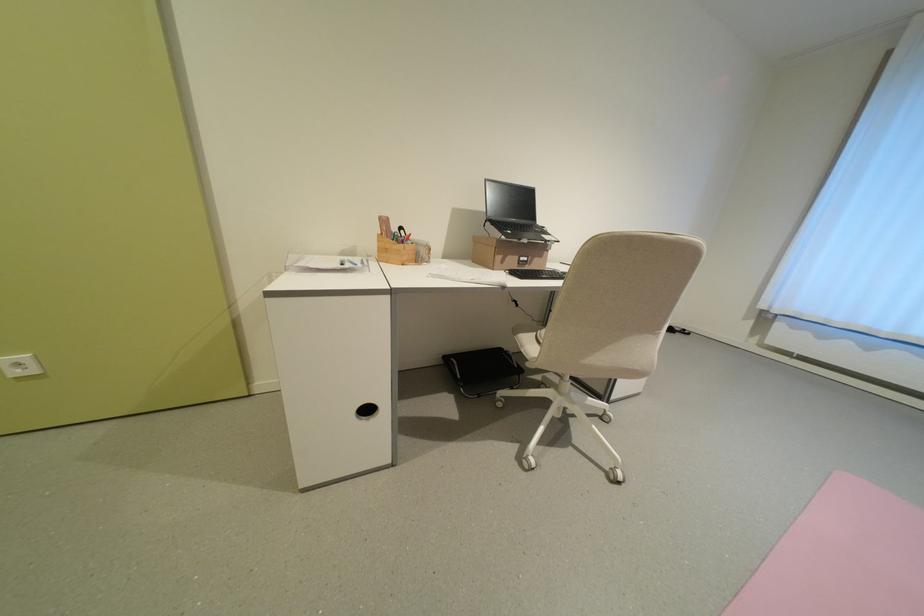
This screenshot has width=924, height=616. Describe the element at coordinates (367, 411) in the screenshot. I see `the round cabinet handle` at that location.